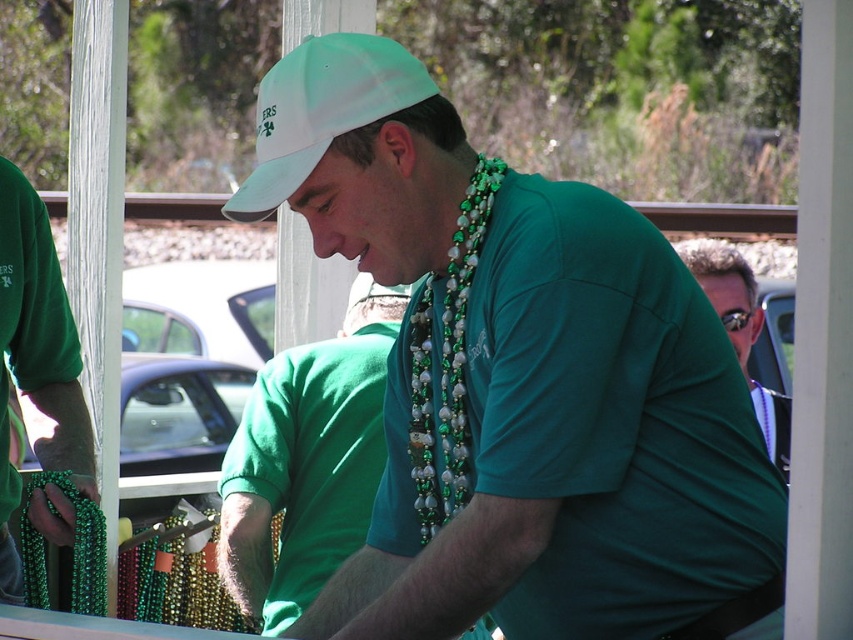
Question: Is white fabric cap at upper center further to the viewer compared to matte green shirt at center?

Choices:
 (A) no
 (B) yes

Answer: (A)

Question: Which object appears farthest from the camera in this image?

Choices:
 (A) green matte shirt at center
 (B) green matte cap at center
 (C) green matte beads at left
 (D) matte green shirt at center

Answer: (D)

Question: Which point is closer to the camera?

Choices:
 (A) matte green shirt at center
 (B) green matte cap at center
 (C) green matte beads at left
 (D) green pearl beads at center

Answer: (B)

Question: Is green matte beads at left to the left of green pearl beads at center from the viewer's perspective?

Choices:
 (A) no
 (B) yes

Answer: (B)

Question: Which object is the farthest from the matte green shirt at center?

Choices:
 (A) green matte beads at left
 (B) green pearl beads at center
 (C) green matte shirt at center

Answer: (B)

Question: Observing the image, what is the correct spatial positioning of green matte cap at center in reference to green matte shirt at center?

Choices:
 (A) above
 (B) below

Answer: (A)